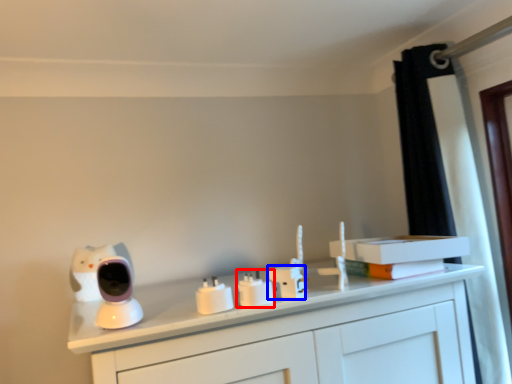
Question: Among these objects, which one is farthest to the camera, electric outlet (highlighted by a red box) or electric outlet (highlighted by a blue box)?

Choices:
 (A) electric outlet
 (B) electric outlet

Answer: (B)